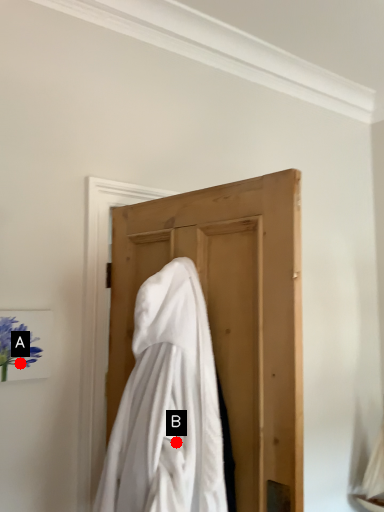
Question: Two points are circled on the image, labeled by A and B beside each circle. Which point is closer to the camera?

Choices:
 (A) A is closer
 (B) B is closer

Answer: (B)